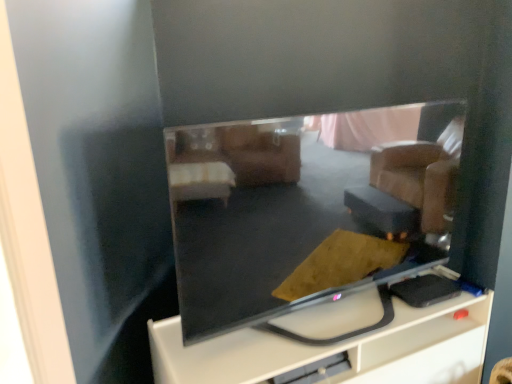
Question: Is the position of matte black tv at center more distant than that of matte black tv at center?

Choices:
 (A) no
 (B) yes

Answer: (B)

Question: Is matte black tv at center positioned with its back to matte black tv at center?

Choices:
 (A) yes
 (B) no

Answer: (B)

Question: Is matte black tv at center with matte black tv at center?

Choices:
 (A) yes
 (B) no

Answer: (B)

Question: Does matte black tv at center turn towards matte black tv at center?

Choices:
 (A) yes
 (B) no

Answer: (B)

Question: Considering the relative sizes of matte black tv at center and matte black tv at center in the image provided, is matte black tv at center bigger than matte black tv at center?

Choices:
 (A) yes
 (B) no

Answer: (A)

Question: Is matte black tv at center positioned in front of matte black tv at center?

Choices:
 (A) yes
 (B) no

Answer: (B)

Question: From a real-world perspective, is matte black tv at center on top of matte black tv at center?

Choices:
 (A) yes
 (B) no

Answer: (A)

Question: Can you confirm if matte black tv at center is shorter than matte black tv at center?

Choices:
 (A) yes
 (B) no

Answer: (B)

Question: Can matte black tv at center be found inside matte black tv at center?

Choices:
 (A) no
 (B) yes

Answer: (A)

Question: Considering the relative positions of matte black tv at center and matte black tv at center in the image provided, is matte black tv at center to the left of matte black tv at center from the viewer's perspective?

Choices:
 (A) no
 (B) yes

Answer: (B)

Question: Is matte black tv at center thinner than matte black tv at center?

Choices:
 (A) yes
 (B) no

Answer: (A)

Question: Is matte black tv at center further to camera compared to matte black tv at center?

Choices:
 (A) yes
 (B) no

Answer: (B)

Question: Is point (237, 196) closer or farther from the camera than point (476, 367)?

Choices:
 (A) closer
 (B) farther

Answer: (A)